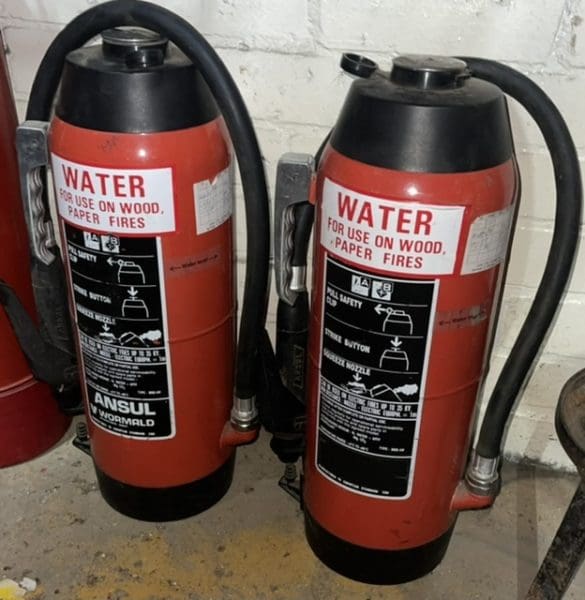
Identify the location of fire extinguisher. [x=190, y=292], [x=13, y=251], [x=446, y=302].